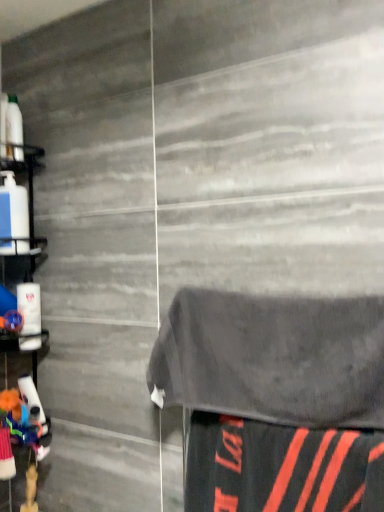
Question: From a real-world perspective, is dark gray towel at center located beneath black matte fabric at lower right?

Choices:
 (A) yes
 (B) no

Answer: (B)

Question: From the image's perspective, does dark gray towel at center appear lower than black matte fabric at lower right?

Choices:
 (A) yes
 (B) no

Answer: (B)

Question: Does dark gray towel at center have a lesser width compared to black matte fabric at lower right?

Choices:
 (A) yes
 (B) no

Answer: (B)

Question: Does dark gray towel at center lie in front of black matte fabric at lower right?

Choices:
 (A) no
 (B) yes

Answer: (A)

Question: Considering the relative sizes of dark gray towel at center and black matte fabric at lower right in the image provided, is dark gray towel at center wider than black matte fabric at lower right?

Choices:
 (A) yes
 (B) no

Answer: (A)

Question: Is dark gray towel at center aimed at black matte fabric at lower right?

Choices:
 (A) no
 (B) yes

Answer: (A)

Question: Considering the relative sizes of black matte fabric at lower right and dark gray towel at center in the image provided, is black matte fabric at lower right thinner than dark gray towel at center?

Choices:
 (A) no
 (B) yes

Answer: (B)

Question: Is black matte fabric at lower right beside dark gray towel at center?

Choices:
 (A) yes
 (B) no

Answer: (B)

Question: From a real-world perspective, is black matte fabric at lower right physically above dark gray towel at center?

Choices:
 (A) yes
 (B) no

Answer: (B)

Question: Considering the relative sizes of black matte fabric at lower right and dark gray towel at center in the image provided, is black matte fabric at lower right bigger than dark gray towel at center?

Choices:
 (A) no
 (B) yes

Answer: (A)

Question: Is black matte fabric at lower right to the right of dark gray towel at center from the viewer's perspective?

Choices:
 (A) yes
 (B) no

Answer: (A)

Question: Does black matte fabric at lower right turn towards dark gray towel at center?

Choices:
 (A) yes
 (B) no

Answer: (B)

Question: Is dark gray towel at center not near white plastic shelf at left?

Choices:
 (A) yes
 (B) no

Answer: (B)